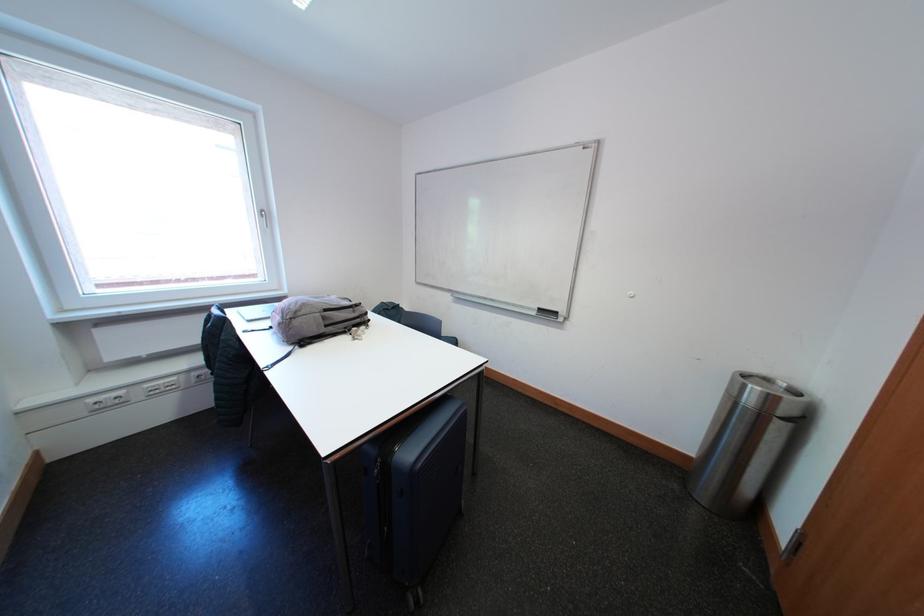
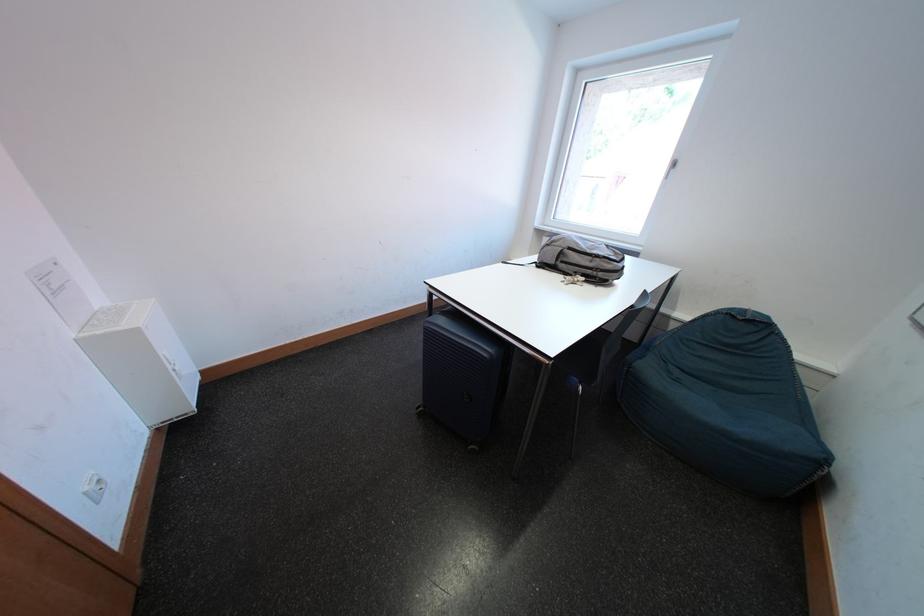
Where in the second image is the point corresponding to point 363,315 from the first image?

(601, 265)